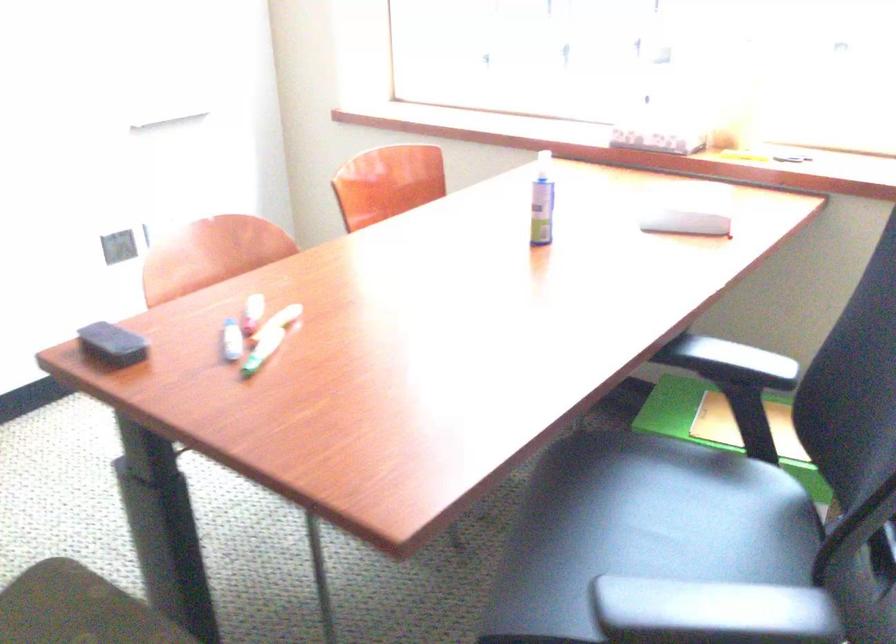
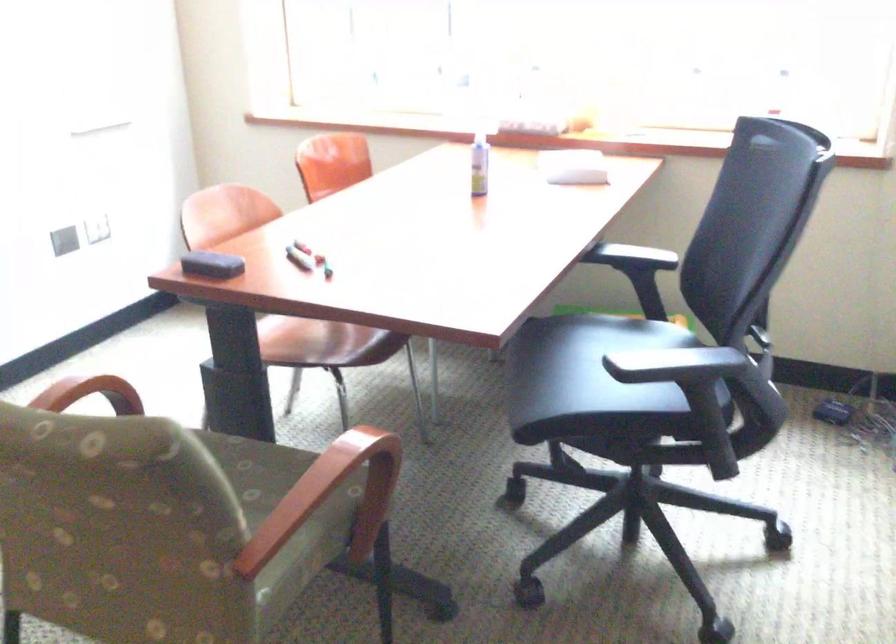
In the second image, find the point that corresponds to [540,202] in the first image.

(478, 164)